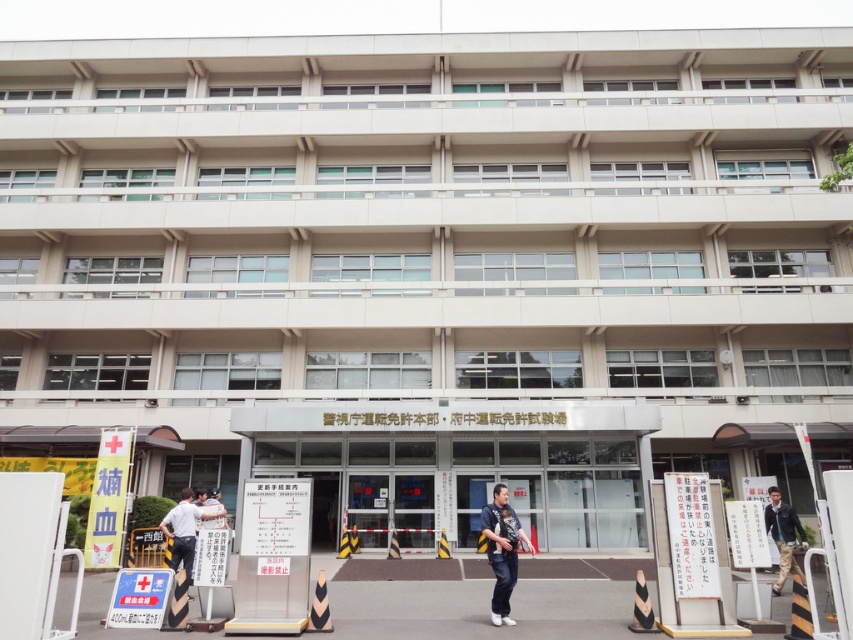
Question: Which point is farther to the camera?

Choices:
 (A) dark blue jeans at center
 (B) dark blue jacket at center

Answer: (B)

Question: Which object is closer to the camera taking this photo?

Choices:
 (A) dark blue jeans at center
 (B) dark blue jacket at center

Answer: (A)

Question: Does dark blue jeans at center have a greater width compared to dark blue jacket at center?

Choices:
 (A) no
 (B) yes

Answer: (A)

Question: Observing the image, what is the correct spatial positioning of dark blue jeans at center in reference to dark blue jacket at center?

Choices:
 (A) left
 (B) right

Answer: (A)

Question: Which of the following is the farthest from the observer?

Choices:
 (A) (769, 518)
 (B) (506, 552)

Answer: (A)

Question: Can you confirm if dark blue jeans at center is thinner than dark blue jacket at center?

Choices:
 (A) no
 (B) yes

Answer: (B)